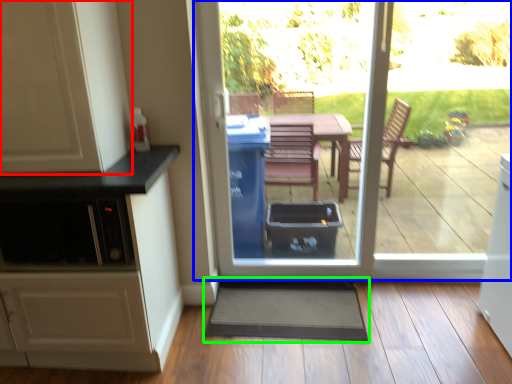
Question: Considering the real-world distances, which object is closest to cabinetry (highlighted by a red box)? door (highlighted by a blue box) or doormat (highlighted by a green box).

Choices:
 (A) door
 (B) doormat

Answer: (A)